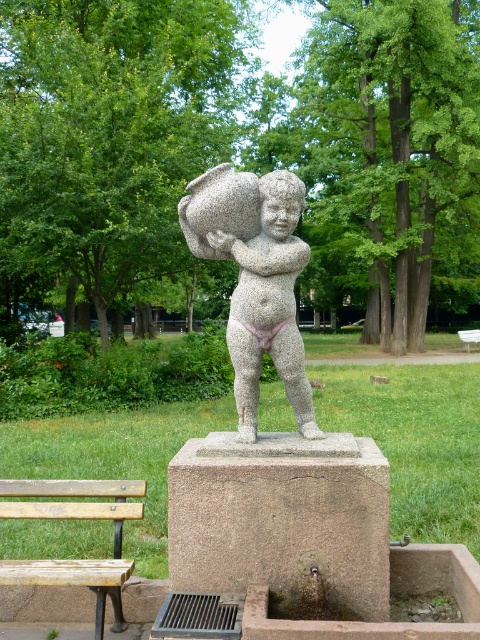
Question: Is granite statue at center to the left of wooden bench at center from the viewer's perspective?

Choices:
 (A) yes
 (B) no

Answer: (A)

Question: Considering the real-world distances, which object is closest to the wooden bench at center?

Choices:
 (A) wooden bench at lower left
 (B) granite statue at center

Answer: (B)

Question: Does wooden bench at lower left appear on the right side of wooden bench at center?

Choices:
 (A) yes
 (B) no

Answer: (B)

Question: Among these objects, which one is farthest from the camera?

Choices:
 (A) wooden bench at lower left
 (B) granite statue at center

Answer: (B)

Question: Which object appears farthest from the camera in this image?

Choices:
 (A) granite statue at center
 (B) wooden bench at center
 (C) wooden bench at lower left

Answer: (B)

Question: Can you confirm if wooden bench at lower left is bigger than wooden bench at center?

Choices:
 (A) no
 (B) yes

Answer: (A)